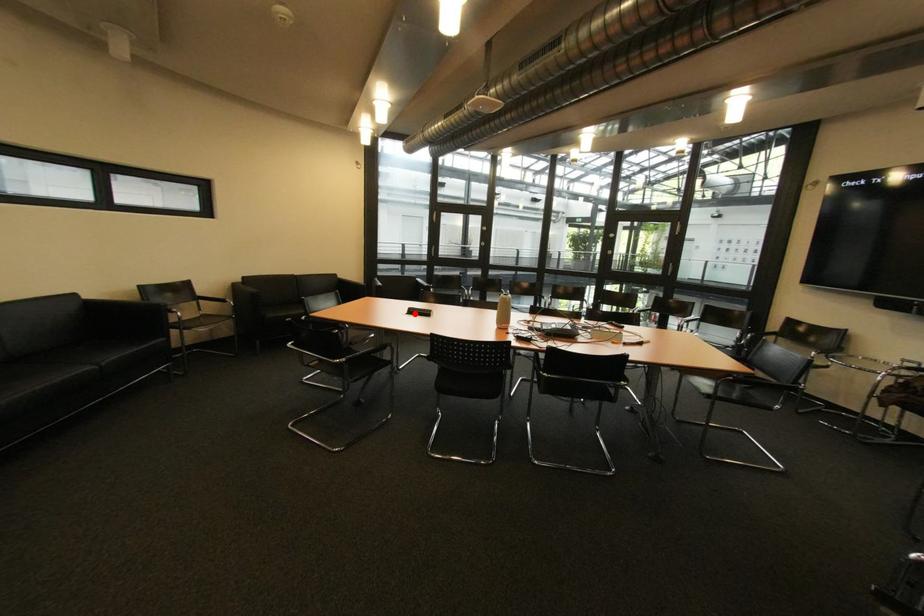
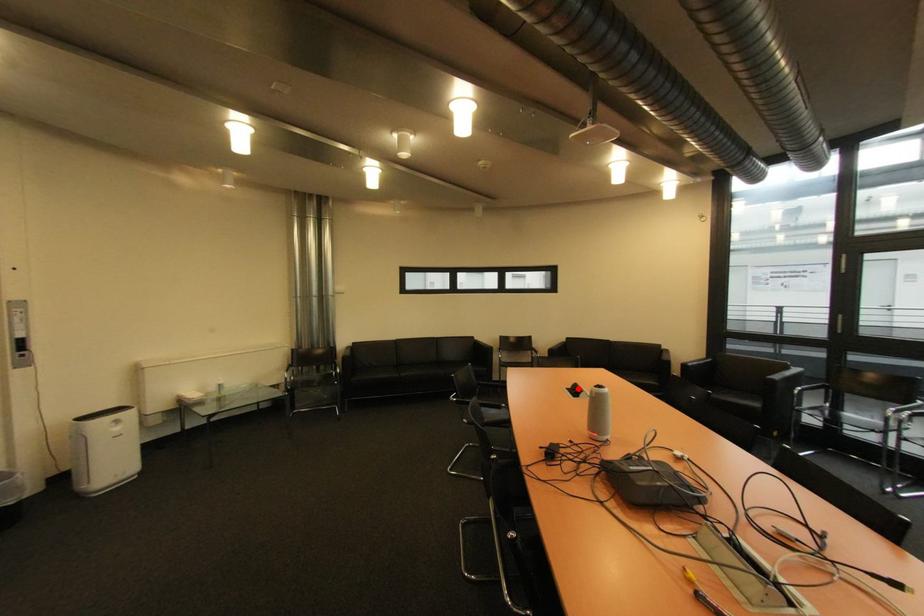
I am providing you with two images of the same scene from different viewpoints. A red point is marked on the first image and another point is marked on the second image. Do the highlighted points in image1 and image2 indicate the same real-world spot?

Yes